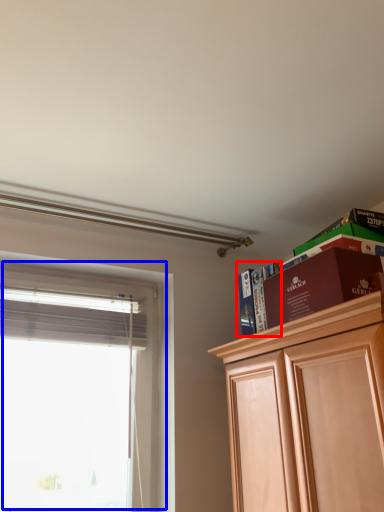
Question: Which point is further to the camera, book (highlighted by a red box) or window (highlighted by a blue box)?

Choices:
 (A) book
 (B) window

Answer: (A)